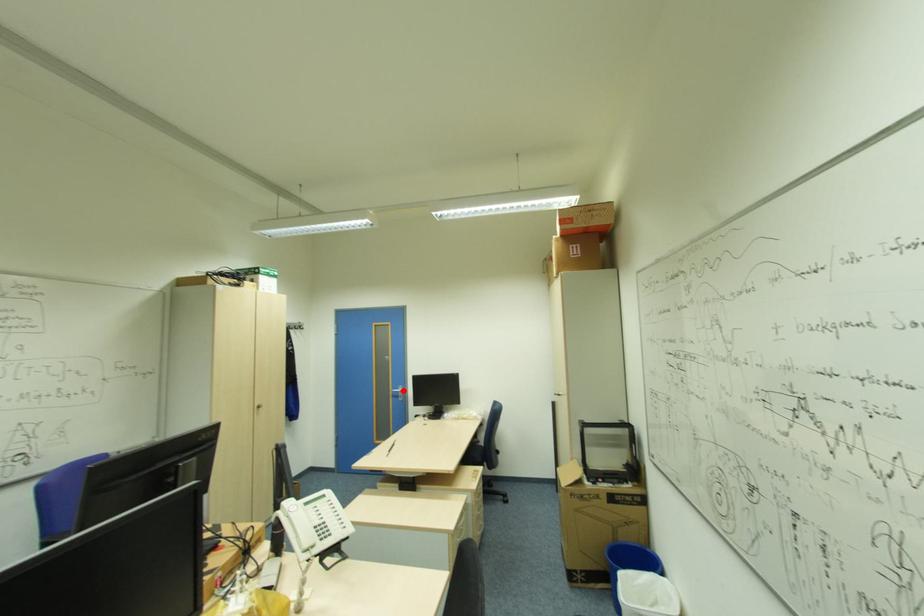
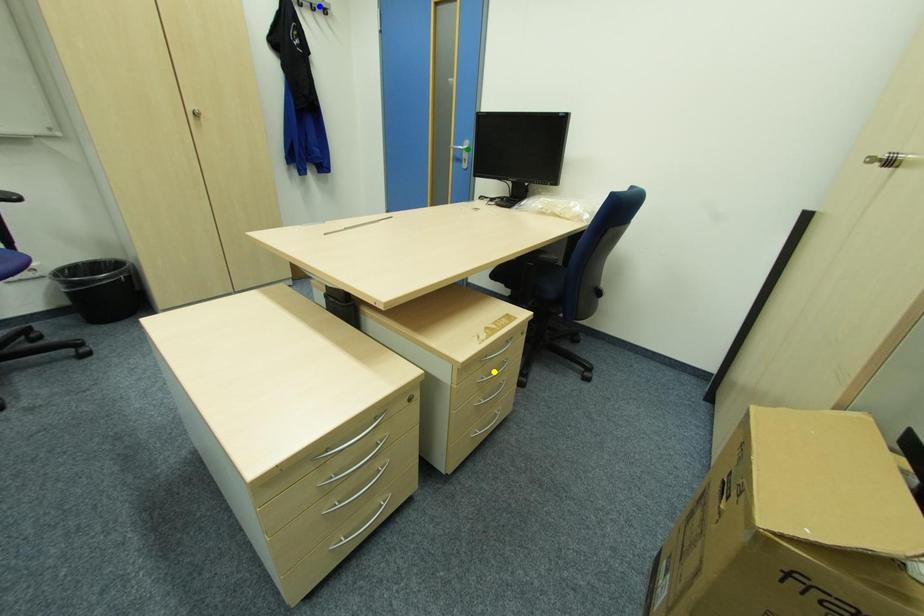
Question: I am providing you with two images of the same scene from different viewpoints. A red point is marked on the first image. You are given multiple points on the second image. In image 2, which mark is for the same physical point as the one in image 1?

Choices:
 (A) green point
 (B) yellow point
 (C) blue point

Answer: (A)